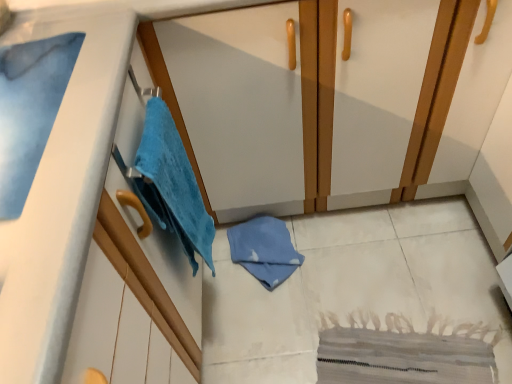
Question: Is matte white dresser at center at the left side of blue soft towel at upper left?

Choices:
 (A) yes
 (B) no

Answer: (B)

Question: Does matte white dresser at center have a lesser width compared to blue soft towel at upper left?

Choices:
 (A) yes
 (B) no

Answer: (B)

Question: Is blue soft towel at upper left completely or partially inside matte white dresser at center?

Choices:
 (A) yes
 (B) no

Answer: (B)

Question: Is matte white dresser at center bigger than blue soft towel at upper left?

Choices:
 (A) no
 (B) yes

Answer: (B)

Question: Is blue soft towel at upper left at the back of matte white dresser at center?

Choices:
 (A) yes
 (B) no

Answer: (B)

Question: Which is correct: blue soft towel at upper left is inside blue soft towel at left, or outside of it?

Choices:
 (A) inside
 (B) outside

Answer: (B)

Question: Considering the positions of blue soft towel at upper left and blue soft towel at left in the image, is blue soft towel at upper left bigger or smaller than blue soft towel at left?

Choices:
 (A) small
 (B) big

Answer: (A)

Question: From the image's perspective, is blue soft towel at upper left above or below blue soft towel at left?

Choices:
 (A) below
 (B) above

Answer: (B)

Question: In terms of width, does blue soft towel at upper left look wider or thinner when compared to blue soft towel at left?

Choices:
 (A) wide
 (B) thin

Answer: (A)

Question: From the image's perspective, is blue soft towel at upper left located above or below matte white dresser at center?

Choices:
 (A) below
 (B) above

Answer: (A)

Question: From a real-world perspective, relative to matte white dresser at center, is blue soft towel at upper left vertically above or below?

Choices:
 (A) below
 (B) above

Answer: (B)

Question: Considering their positions, is blue soft towel at upper left located in front of or behind matte white dresser at center?

Choices:
 (A) front
 (B) behind

Answer: (A)

Question: Would you say blue soft towel at upper left is to the left or to the right of matte white dresser at center in the picture?

Choices:
 (A) right
 (B) left

Answer: (B)

Question: Is matte white dresser at center inside or outside of blue soft towel at upper left?

Choices:
 (A) inside
 (B) outside

Answer: (B)

Question: From a real-world perspective, is matte white dresser at center positioned above or below blue soft towel at upper left?

Choices:
 (A) below
 (B) above

Answer: (A)